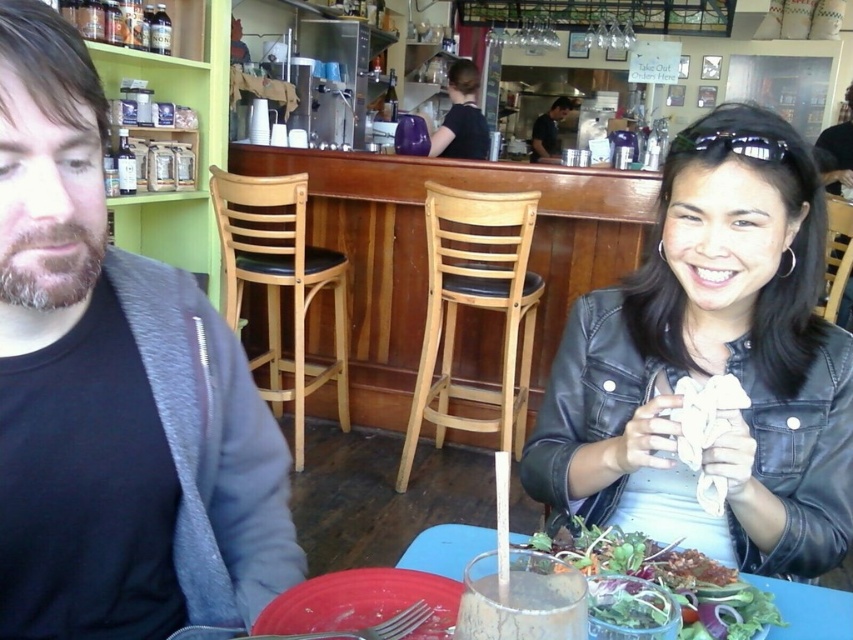
This screenshot has width=853, height=640. Find the location of `black matte jacket at left`. black matte jacket at left is located at coordinates (114, 392).

Based on the photo, who is higher up, black matte jacket at left or fresh green salad at lower center?

black matte jacket at left is above.

Between point (241, 624) and point (712, 637), which one is positioned behind?

Point (241, 624)

Locate an element on the screen. This screenshot has height=640, width=853. black matte jacket at left is located at coordinates (114, 392).

Consider the image. Is black reflective sunglasses at upper center further to camera compared to black leather jacket at center?

No, it is in front of black leather jacket at center.

Can you confirm if black reflective sunglasses at upper center is thinner than black leather jacket at center?

Yes.

Measure the distance between black reflective sunglasses at upper center and camera.

black reflective sunglasses at upper center and camera are 34.96 inches apart.

At what (x,y) coordinates should I click in order to perform the action: click on black reflective sunglasses at upper center. Please return your answer as a coordinate pair (x, y). This screenshot has height=640, width=853. Looking at the image, I should click on (729, 145).

Who is positioned more to the left, fresh green salad at lower center or black leather jacket at center?

fresh green salad at lower center is more to the left.

Can you confirm if fresh green salad at lower center is positioned above black leather jacket at center?

No.

This screenshot has width=853, height=640. What do you see at coordinates (669, 579) in the screenshot?
I see `fresh green salad at lower center` at bounding box center [669, 579].

The image size is (853, 640). I want to click on fresh green salad at lower center, so click(669, 579).